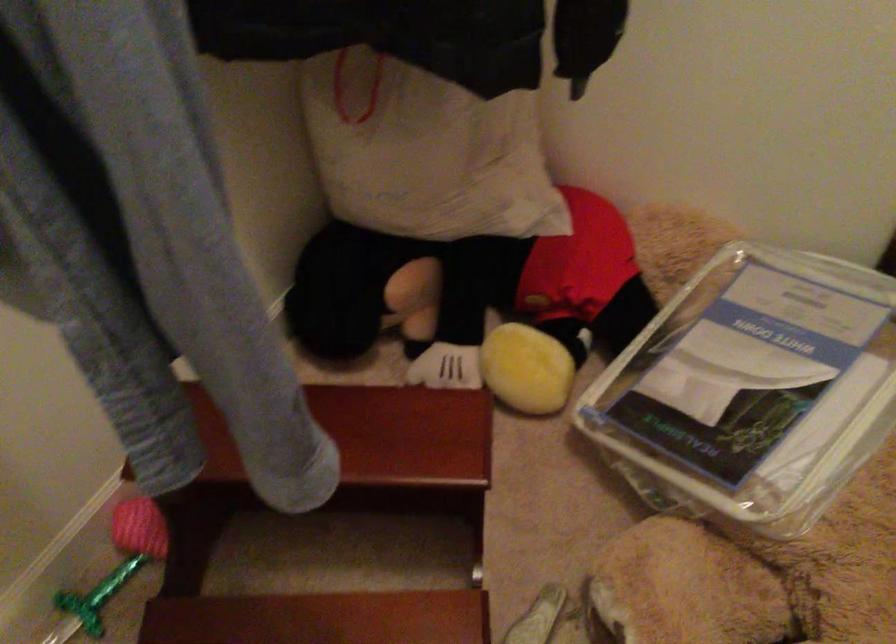
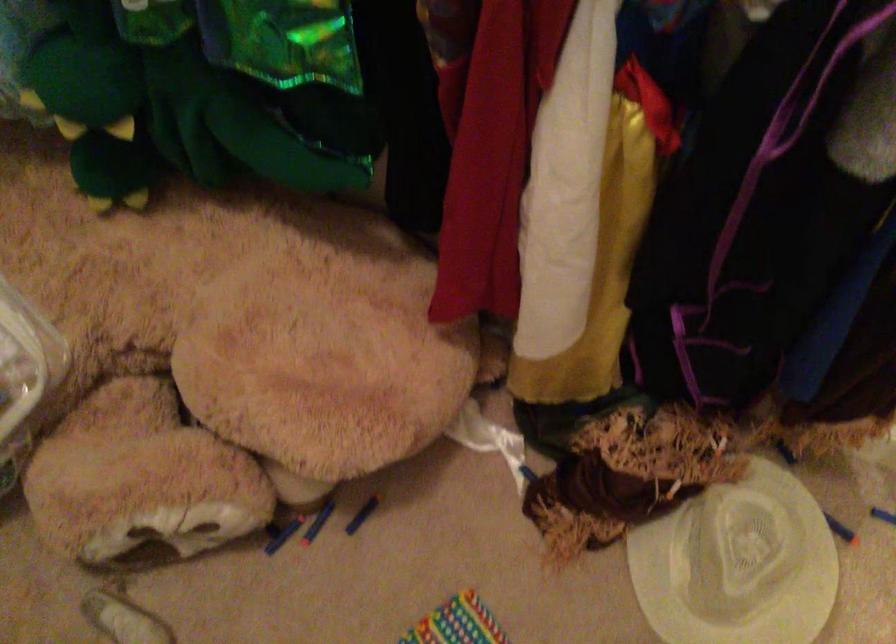
First-person continuous shooting, in which direction is the camera rotating?

The camera's rotation is toward right-down.